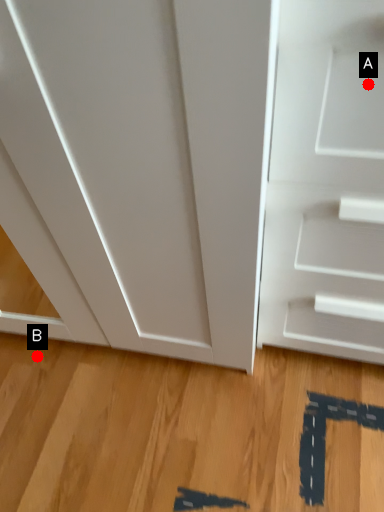
Question: Two points are circled on the image, labeled by A and B beside each circle. Which point is closer to the camera taking this photo?

Choices:
 (A) A is closer
 (B) B is closer

Answer: (A)